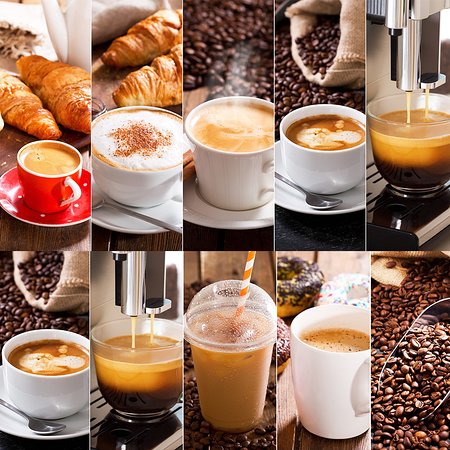
Identify the location of total amount of cups with saucers. This screenshot has height=450, width=450. (78, 409), (52, 210), (145, 204), (232, 207), (333, 191).